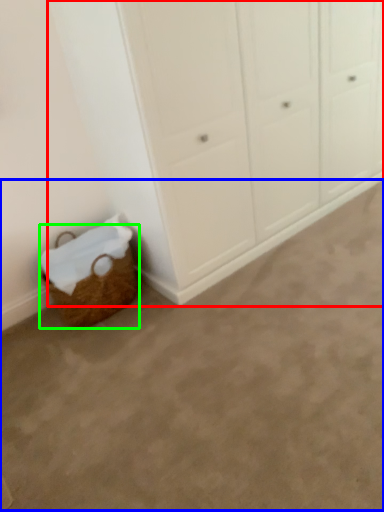
Question: Which is nearer to the cupboard (highlighted by a red box)? plain (highlighted by a blue box) or basket (highlighted by a green box).

Choices:
 (A) plain
 (B) basket

Answer: (B)